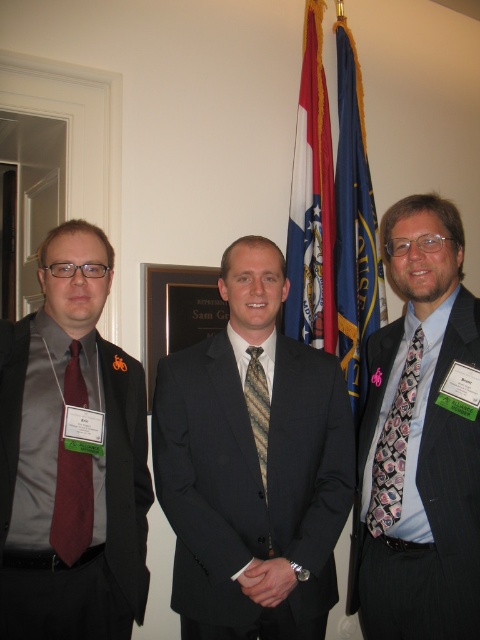
Describe the element at coordinates (312, 202) in the screenshot. Image resolution: width=480 pixels, height=640 pixels. I see `blue fabric flag at upper center` at that location.

Locate an element on the screen. This screenshot has height=640, width=480. blue fabric flag at upper center is located at coordinates (312, 202).

Can you confirm if patterned silk tie at center is shorter than wooden plaque at center?

Incorrect, patterned silk tie at center's height does not fall short of wooden plaque at center's.

Locate an element on the screen. patterned silk tie at center is located at coordinates (419, 442).

Does point (29, 483) come farther from viewer compared to point (388, 461)?

No, (29, 483) is in front of (388, 461).

Does point (34, 353) lie behind point (407, 429)?

Yes.

Where is `matte black suit at left`? The image size is (480, 640). matte black suit at left is located at coordinates (71, 458).